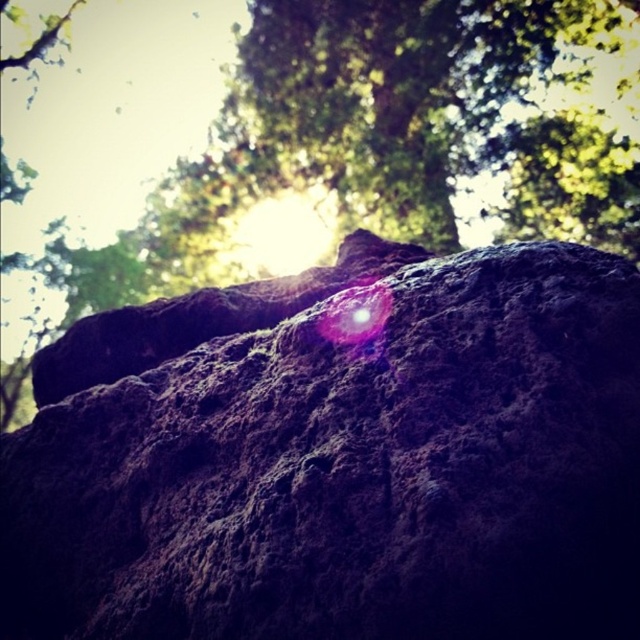
You are examining a rock surface with two points marked. The first point is at coordinates point [371,417] and the second is at point [122,234]. From your perspective, which point is nearer to you?

Point [371,417] is closer to the camera than point [122,234], so the first point is nearer to you.

You are a hiker trying to identify landmarks in the forest. You notice the dark brown rough rock at center and the green rough bark at upper center. Which of these two landmarks is smaller in size?

The dark brown rough rock at center is smaller in size compared to the green rough bark at upper center.

You are a geologist examining the rock surface. You notice a point at coordinates point (339,456). What does this point represent?

The point (339,456) represents the dark brown rough rock at center.